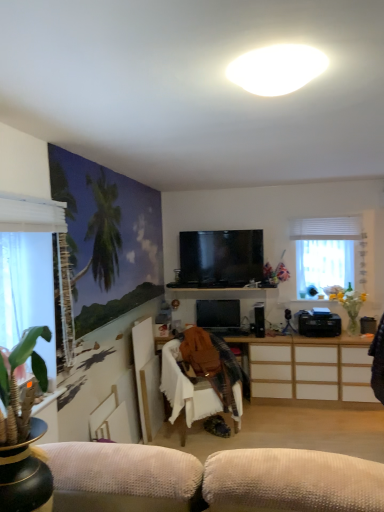
Question: Is point (306, 353) closer or farther from the camera than point (344, 243)?

Choices:
 (A) closer
 (B) farther

Answer: (A)

Question: From their relative heights in the image, would you say white wood cabinet at center is taller or shorter than white sheer curtain at right?

Choices:
 (A) short
 (B) tall

Answer: (B)

Question: Which object is positioned farthest from the flat screen tv at center, marked as the 2th television in a bottom-to-top arrangement?

Choices:
 (A) white sheer curtain at left, placed as the second window when sorted from right to left
 (B) white matte oval light at upper center
 (C) translucent glass vase at right
 (D) black plastic printer at lower right
 (E) white sheer curtain at right

Answer: (B)

Question: Based on their relative distances, which object is nearer to the white wood cabinet at center?

Choices:
 (A) black plastic speaker at center
 (B) white fabric chair at center
 (C) white matte oval light at upper center
 (D) translucent glass vase at right
 (E) white sheer curtain at right, which is the second window in front-to-back order

Answer: (A)